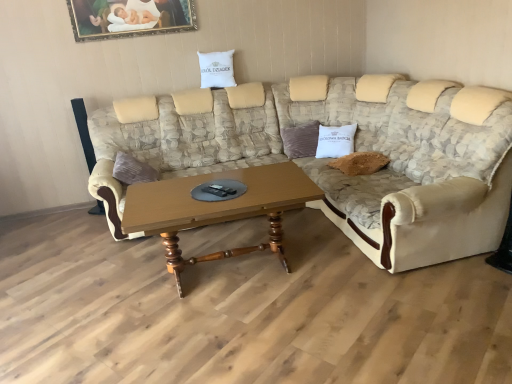
Question: Is white cotton pillow at center, marked as the first pillow in a bottom-to-top arrangement, inside the boundaries of gold-framed painting at upper center, or outside?

Choices:
 (A) outside
 (B) inside

Answer: (A)

Question: From the image's perspective, is white cotton pillow at center, the second pillow from the left, positioned above or below gold-framed painting at upper center?

Choices:
 (A) below
 (B) above

Answer: (A)

Question: Which is nearer to the wooden polished coffee table at center?

Choices:
 (A) white cotton pillow at upper center, which ranks as the second pillow in bottom-to-top order
 (B) white cotton pillow at center, marked as the first pillow in a right-to-left arrangement
 (C) gold-framed painting at upper center
 (D) beige fabric couch at center

Answer: (D)

Question: Which object is positioned farthest from the white cotton pillow at center, which is the second pillow from top to bottom?

Choices:
 (A) beige fabric couch at center
 (B) white cotton pillow at upper center, which is the first pillow from left to right
 (C) wooden polished coffee table at center
 (D) gold-framed painting at upper center

Answer: (D)